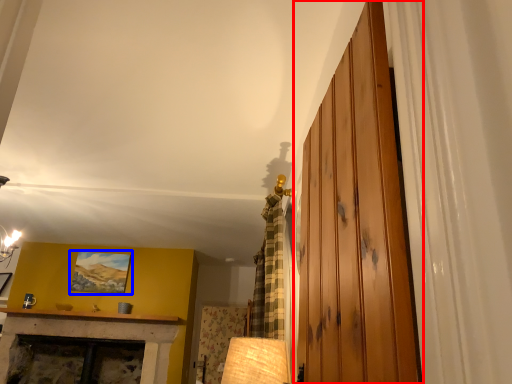
Question: Which of the following is the farthest to the observer, barn door (highlighted by a red box) or picture frame (highlighted by a blue box)?

Choices:
 (A) barn door
 (B) picture frame

Answer: (B)